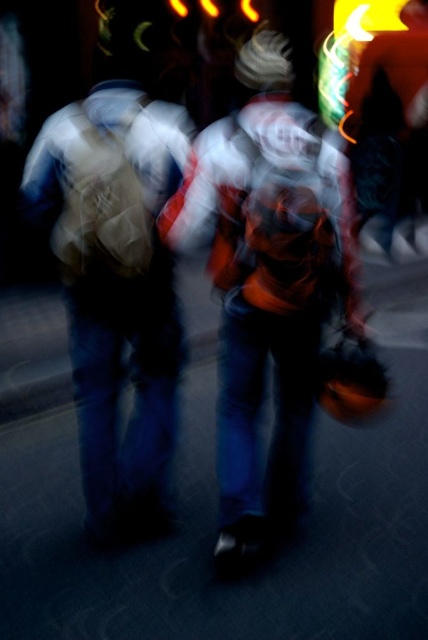
Does orange fabric jacket at center come behind matte brown backpack at left?

No, it is not.

Is orange fabric jacket at center to the left of matte brown backpack at left from the viewer's perspective?

No, orange fabric jacket at center is not to the left of matte brown backpack at left.

In order to click on orange fabric jacket at center in this screenshot , I will do `click(267, 276)`.

You are a GUI agent. You are given a task and a screenshot of the screen. Output one action in this format:
    pyautogui.click(x=<x>, y=<y>)
    Task: Click on the orange fabric jacket at center
    The height and width of the screenshot is (640, 428).
    Given the screenshot: What is the action you would take?
    pyautogui.click(x=267, y=276)